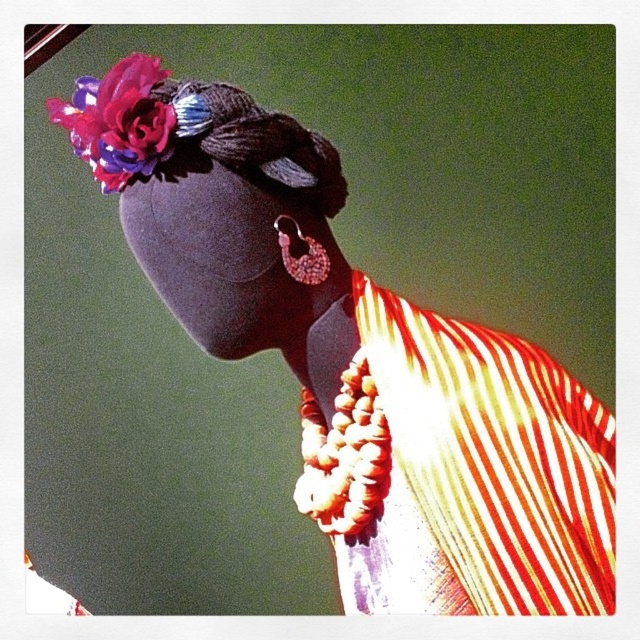
You are a photographer adjusting your camera settings to focus on the striped fabric dress at center and the velvet floral headpiece at upper left. Which object should you focus on first if you want to ensure both are in focus without changing the camera position?

The striped fabric dress at center is closer to the viewer than the velvet floral headpiece at upper left, so you should focus on the velvet floral headpiece at upper left first to ensure both are in focus.